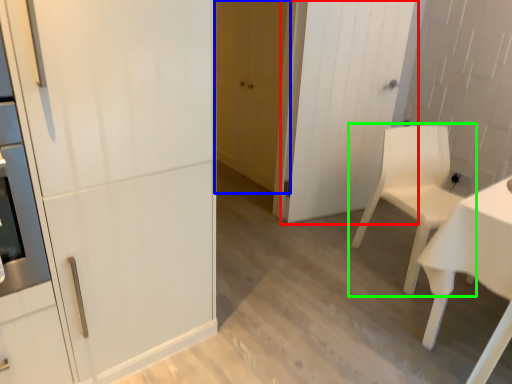
Question: Which is nearer to the door (highlighted by a red box)? door (highlighted by a blue box) or chair (highlighted by a green box).

Choices:
 (A) door
 (B) chair

Answer: (B)